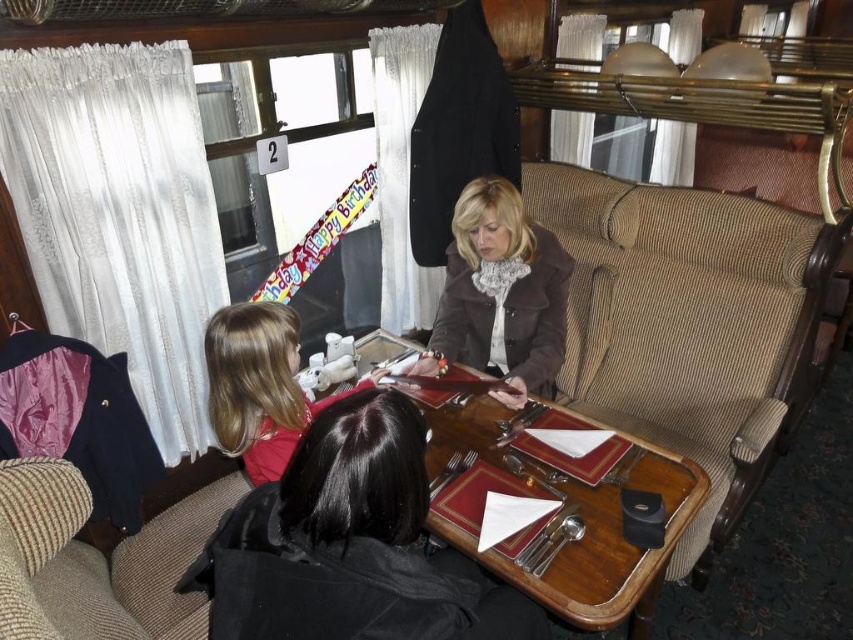
Question: Does black fabric jacket at center have a smaller size compared to wooden table at center?

Choices:
 (A) yes
 (B) no

Answer: (A)

Question: Observing the image, what is the correct spatial positioning of wooden table at center in reference to matte brown jacket at center?

Choices:
 (A) above
 (B) below

Answer: (B)

Question: Which of these objects is positioned farthest from the beige corduroy armchair at lower left?

Choices:
 (A) black fabric jacket at center
 (B) matte brown jacket at center

Answer: (B)

Question: From the image, what is the correct spatial relationship of wooden table at center in relation to blonde hair at center?

Choices:
 (A) right
 (B) left

Answer: (A)

Question: Considering the real-world distances, which object is closest to the beige corduroy armchair at lower left?

Choices:
 (A) matte brown jacket at center
 (B) wooden table at center
 (C) blonde hair at center

Answer: (C)

Question: Which point appears closest to the camera in this image?

Choices:
 (A) (10, 572)
 (B) (224, 344)

Answer: (A)